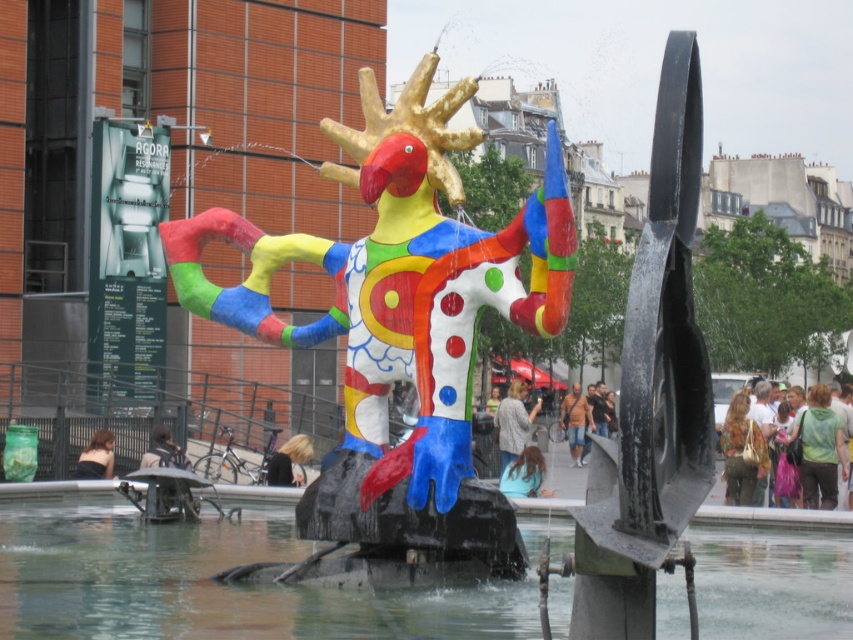
Locate an element on the screen. multicolored painted sculpture at center is located at coordinates point(399,340).

Does multicolored painted sculpture at center have a lesser height compared to matte gray sweater at center?

No.

Where is `multicolored painted sculpture at center`? This screenshot has width=853, height=640. multicolored painted sculpture at center is located at coordinates (399, 340).

Where is `multicolored painted sculpture at center`? The width and height of the screenshot is (853, 640). multicolored painted sculpture at center is located at coordinates (399, 340).

Between green fabric purse at center right and matte gray sweater at center, which one is positioned lower?

matte gray sweater at center

Does green fabric purse at center right have a lesser width compared to matte gray sweater at center?

No.

Does point (821, 452) lie behind point (503, 436)?

That is False.

Identify the location of green fabric purse at center right. click(819, 448).

Can you confirm if dark brown leather jacket at lower left is taller than matte gray sweater at center?

In fact, dark brown leather jacket at lower left may be shorter than matte gray sweater at center.

Does dark brown leather jacket at lower left have a larger size compared to matte gray sweater at center?

Actually, dark brown leather jacket at lower left might be smaller than matte gray sweater at center.

Is point (149, 440) positioned in front of point (498, 416)?

That is True.

Identify the location of dark brown leather jacket at lower left. Image resolution: width=853 pixels, height=640 pixels. (167, 499).